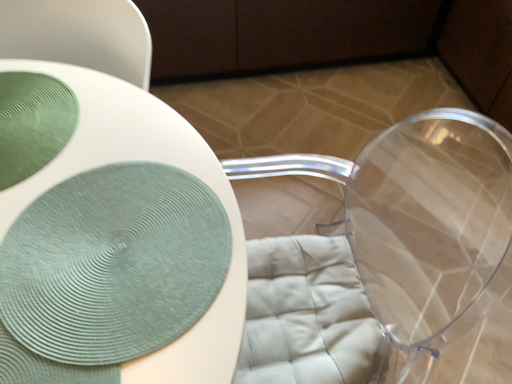
This screenshot has width=512, height=384. What do you see at coordinates (32, 123) in the screenshot?
I see `green textured plate at upper left` at bounding box center [32, 123].

What is the approximate height of green textured plate at upper left?

0.41 inches.

Find the location of a particular element. The height and width of the screenshot is (384, 512). green textured plate at upper left is located at coordinates (32, 123).

What do you see at coordinates (149, 161) in the screenshot? The height and width of the screenshot is (384, 512). I see `green textured placemat at center` at bounding box center [149, 161].

The width and height of the screenshot is (512, 384). Identify the location of green textured placemat at center. (149, 161).

The height and width of the screenshot is (384, 512). In order to click on green textured plate at upper left in this screenshot , I will do `click(32, 123)`.

Which is more to the right, green textured plate at upper left or green textured placemat at center?

green textured placemat at center.

Is green textured plate at upper left in front of or behind green textured placemat at center in the image?

Visually, green textured plate at upper left is located behind green textured placemat at center.

Does point (15, 173) come behind point (199, 366)?

That is True.

From the image's perspective, which one is positioned higher, green textured plate at upper left or green textured placemat at center?

green textured plate at upper left is shown above in the image.

From a real-world perspective, which object rests below the other?

green textured placemat at center, from a real-world perspective.

Does green textured plate at upper left have a lesser width compared to green textured placemat at center?

Correct, the width of green textured plate at upper left is less than that of green textured placemat at center.

Who is taller, green textured plate at upper left or green textured placemat at center?

green textured placemat at center is taller.

In the scene shown: Who is bigger, green textured plate at upper left or green textured placemat at center?

green textured placemat at center is bigger.

Would you say green textured plate at upper left is outside green textured placemat at center?

No, green textured plate at upper left is inside or overlapping with green textured placemat at center.

Is green textured plate at upper left beside green textured placemat at center?

No.

Could you tell me if green textured plate at upper left is turned towards green textured placemat at center?

Yes, green textured plate at upper left faces towards green textured placemat at center.

Can you tell me how much green textured plate at upper left and green textured placemat at center differ in facing direction?

green textured plate at upper left and green textured placemat at center are facing 134 degrees away from each other.

Find the location of a particular element. The height and width of the screenshot is (384, 512). glass plate to the left of green textured placemat at center is located at coordinates (32, 123).

Between green textured placemat at center and green textured plate at upper left, which one appears on the right side from the viewer's perspective?

From the viewer's perspective, green textured placemat at center appears more on the right side.

In the image, is green textured placemat at center positioned in front of or behind green textured plate at upper left?

Clearly, green textured placemat at center is in front of green textured plate at upper left.

Which is in front, point (118, 144) or point (39, 130)?

The point (118, 144) is more forward.

From the image's perspective, which is above, green textured placemat at center or green textured plate at upper left?

green textured plate at upper left is shown above in the image.

From a real-world perspective, is green textured placemat at center over green textured plate at upper left?

Actually, green textured placemat at center is physically below green textured plate at upper left in the real world.

Does green textured placemat at center have a lesser width compared to green textured plate at upper left?

No, green textured placemat at center is not thinner than green textured plate at upper left.

Is green textured placemat at center shorter than green textured plate at upper left?

In fact, green textured placemat at center may be taller than green textured plate at upper left.

Can you confirm if green textured placemat at center is bigger than green textured plate at upper left?

Indeed, green textured placemat at center has a larger size compared to green textured plate at upper left.

Can green textured plate at upper left be found inside green textured placemat at center?

Yes, green textured plate at upper left is inside green textured placemat at center.

Would you say green textured placemat at center is a long distance from green textured plate at upper left?

That's not correct — green textured placemat at center is a little close to green textured plate at upper left.

Is green textured placemat at center aimed at green textured plate at upper left?

No, green textured placemat at center is not turned towards green textured plate at upper left.

How different are the orientations of green textured placemat at center and green textured plate at upper left in degrees?

134 degrees.

The height and width of the screenshot is (384, 512). Find the location of `glass plate above the green textured placemat at center (from the image's perspective)`. glass plate above the green textured placemat at center (from the image's perspective) is located at coordinates (32, 123).

Identify the location of table that appears below the green textured plate at upper left (from the image's perspective). The width and height of the screenshot is (512, 384). (149, 161).

What are the coordinates of `table on the right of green textured plate at upper left` in the screenshot? It's located at click(149, 161).